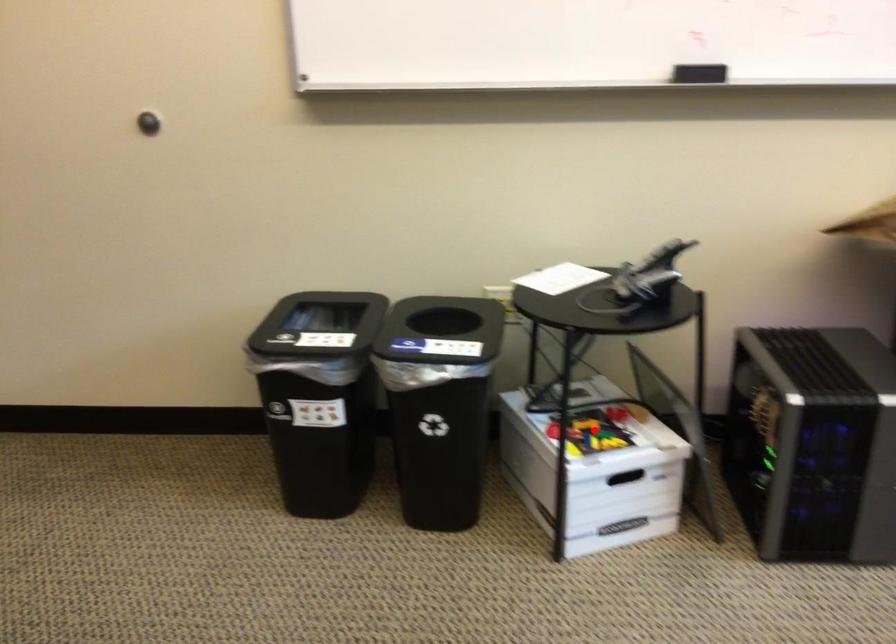
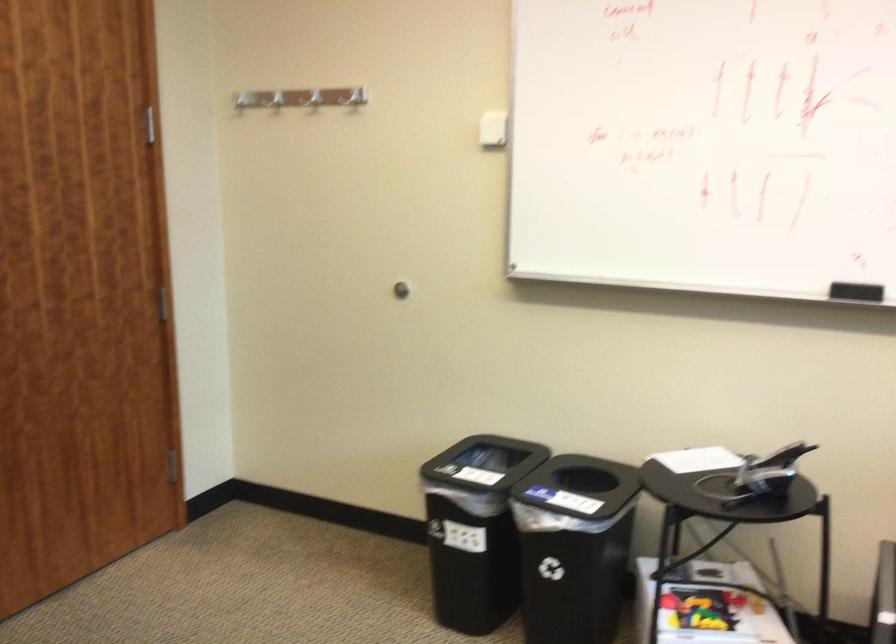
Where in the second image is the point corresponding to the highlighted location from the first image?

(701, 609)